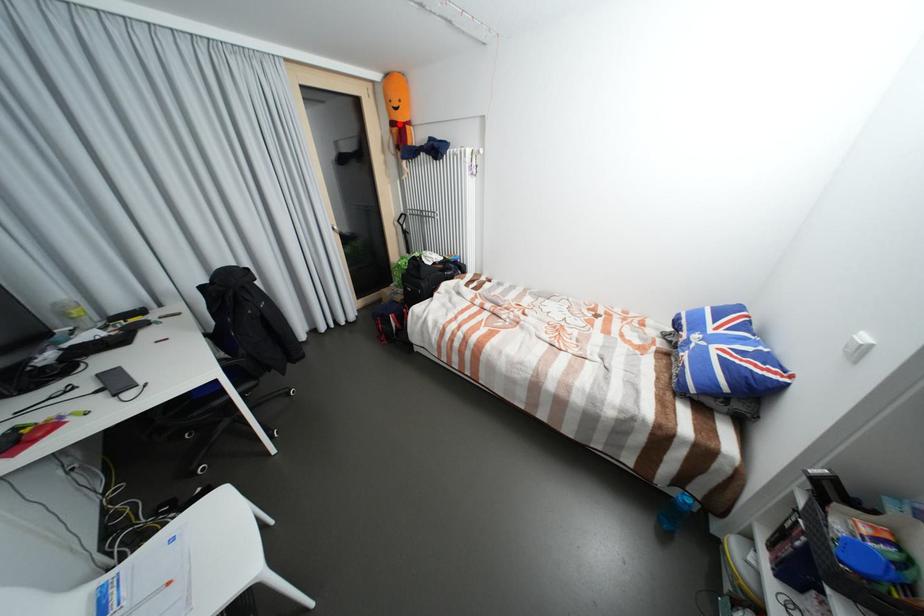
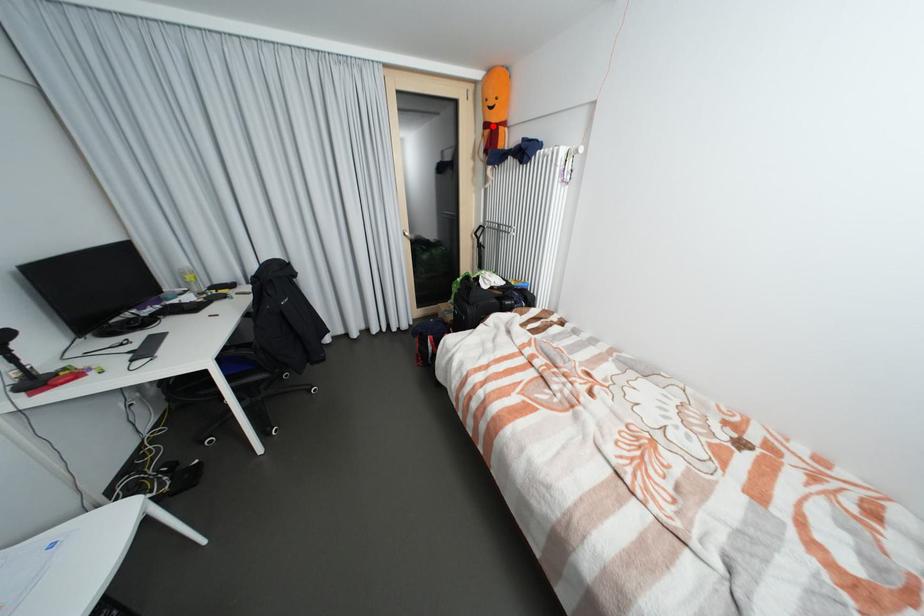
Based on the photo, I am providing you with two images of the same scene from different viewpoints. A red point is marked on the first image and another point is marked on the second image. Are the points marked in image1 and image2 representing the same 3D position?

Yes